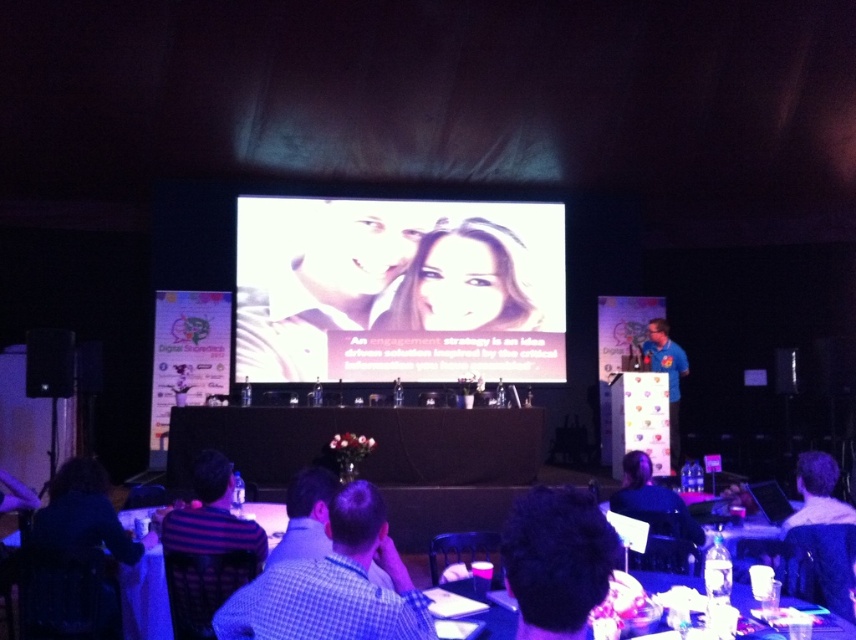
Is checkered shirt at lower center below blue shirt at right?

Actually, checkered shirt at lower center is above blue shirt at right.

What are the coordinates of `checkered shirt at lower center` in the screenshot? It's located at (333, 586).

Where is `checkered shirt at lower center`? checkered shirt at lower center is located at coordinates (333, 586).

This screenshot has width=856, height=640. Find the location of `checkered shirt at lower center`. checkered shirt at lower center is located at coordinates (333, 586).

Can you confirm if white glossy projection screen at center is taller than translucent plastic table at lower center?

Yes.

This screenshot has width=856, height=640. Describe the element at coordinates (396, 285) in the screenshot. I see `white glossy projection screen at center` at that location.

Is point (535, 296) in front of point (456, 593)?

That is False.

At what (x,y) coordinates should I click in order to perform the action: click on white glossy projection screen at center. Please return your answer as a coordinate pair (x, y). The image size is (856, 640). Looking at the image, I should click on (396, 285).

Looking at this image, is smooth skin face at center above translucent plastic table at lower center?

Yes, smooth skin face at center is above translucent plastic table at lower center.

Which is more to the left, smooth skin face at center or translucent plastic table at lower center?

smooth skin face at center is more to the left.

Measure the distance between point (503, 234) and camera.

They are 27.72 feet apart.

Where is `smooth skin face at center`? smooth skin face at center is located at coordinates (462, 282).